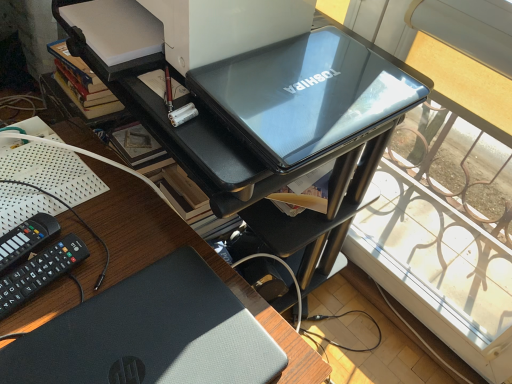
What do you see at coordinates (150, 334) in the screenshot? I see `slate gray matte laptop at lower left` at bounding box center [150, 334].

Locate an element on the screen. glossy white printer at upper center is located at coordinates (186, 27).

You are a GUI agent. You are given a task and a screenshot of the screen. Output one action in this format:
    pyautogui.click(x=<x>, y=<y>)
    Task: Click on the black plastic remote control at lower left, placed as the 1th equipment when sorted from left to right
    This screenshot has height=384, width=512.
    Given the screenshot: What is the action you would take?
    pyautogui.click(x=26, y=239)

What is the approximate height of black plastic remote control at lower left, placed as the 1th equipment when sorted from left to right?

The height of black plastic remote control at lower left, placed as the 1th equipment when sorted from left to right, is 1.17 inches.

The width and height of the screenshot is (512, 384). What are the coordinates of `slate gray matte laptop at lower left` in the screenshot? It's located at (150, 334).

Considering the positions of point (320, 83) and point (18, 355), is point (320, 83) closer or farther from the camera than point (18, 355)?

Point (320, 83) is positioned farther from the camera compared to point (18, 355).

Can slate gray matte laptop at lower left be found inside glossy black laptop at upper center?

Actually, slate gray matte laptop at lower left is outside glossy black laptop at upper center.

From the image's perspective, is glossy black laptop at upper center under slate gray matte laptop at lower left?

Actually, glossy black laptop at upper center appears above slate gray matte laptop at lower left in the image.

Is slate gray matte laptop at lower left placed right next to glossy white printer at upper center?

No.

Which point is more forward, (x=198, y=341) or (x=160, y=7)?

Positioned in front is point (x=198, y=341).

Looking at this image, choose the correct answer: Is slate gray matte laptop at lower left inside glossy white printer at upper center or outside it?

slate gray matte laptop at lower left lies outside glossy white printer at upper center.

From the picture: From the image's perspective, is slate gray matte laptop at lower left under glossy white printer at upper center?

Yes.

Does point (38, 256) come in front of point (187, 342)?

No, it is behind (187, 342).

Who is bigger, black plastic remote control at lower left, which ranks as the second equipment in left-to-right order, or slate gray matte laptop at lower left?

Bigger between the two is slate gray matte laptop at lower left.

Considering the relative sizes of black plastic remote control at lower left, which ranks as the second equipment in left-to-right order, and slate gray matte laptop at lower left in the image provided, is black plastic remote control at lower left, which ranks as the second equipment in left-to-right order, shorter than slate gray matte laptop at lower left?

Incorrect, the height of black plastic remote control at lower left, which ranks as the second equipment in left-to-right order, does not fall short of that of slate gray matte laptop at lower left.

How far apart are black plastic remote control at lower left, which ranks as the first equipment in right-to-left order, and slate gray matte laptop at lower left?

The distance of black plastic remote control at lower left, which ranks as the first equipment in right-to-left order, from slate gray matte laptop at lower left is 16.54 centimeters.

Which is more to the left, glossy black laptop at upper center or glossy white printer at upper center?

From the viewer's perspective, glossy white printer at upper center appears more on the left side.

Between glossy black laptop at upper center and glossy white printer at upper center, which one has less height?

Standing shorter between the two is glossy black laptop at upper center.

Which point is more forward, (229, 102) or (215, 11)?

Positioned in front is point (229, 102).

Can you see glossy black laptop at upper center touching glossy white printer at upper center?

No, glossy black laptop at upper center is not next to glossy white printer at upper center.

From a real-world perspective, who is located lower, glossy white printer at upper center or black plastic remote control at lower left, the second equipment positioned from the right?

From a 3D spatial view, black plastic remote control at lower left, the second equipment positioned from the right, is below.

From the image's perspective, does glossy white printer at upper center appear higher than black plastic remote control at lower left, the second equipment positioned from the right?

Indeed, from the image's perspective, glossy white printer at upper center is shown above black plastic remote control at lower left, the second equipment positioned from the right.

Looking at this image, measure the distance between glossy white printer at upper center and black plastic remote control at lower left, placed as the 1th equipment when sorted from left to right.

glossy white printer at upper center and black plastic remote control at lower left, placed as the 1th equipment when sorted from left to right, are 16.28 inches apart from each other.

Would you say glossy black laptop at upper center is part of black plastic remote control at lower left, which ranks as the second equipment in left-to-right order,'s contents?

Actually, glossy black laptop at upper center is outside black plastic remote control at lower left, which ranks as the second equipment in left-to-right order.

Does black plastic remote control at lower left, which ranks as the second equipment in left-to-right order, have a larger size compared to glossy black laptop at upper center?

Incorrect, black plastic remote control at lower left, which ranks as the second equipment in left-to-right order, is not larger than glossy black laptop at upper center.

Between point (0, 295) and point (324, 107), which one is positioned behind?

The point (324, 107) is more distant.

Is black plastic remote control at lower left, which ranks as the second equipment in left-to-right order, wider or thinner than glossy black laptop at upper center?

In the image, black plastic remote control at lower left, which ranks as the second equipment in left-to-right order, appears to be more narrow than glossy black laptop at upper center.

Is glossy white printer at upper center not close to black plastic remote control at lower left, which ranks as the first equipment in right-to-left order?

glossy white printer at upper center is near black plastic remote control at lower left, which ranks as the first equipment in right-to-left order, not far away.

From their relative heights in the image, would you say glossy white printer at upper center is taller or shorter than black plastic remote control at lower left, which ranks as the first equipment in right-to-left order?

In the image, glossy white printer at upper center appears to be taller than black plastic remote control at lower left, which ranks as the first equipment in right-to-left order.

From the image's perspective, is glossy white printer at upper center on black plastic remote control at lower left, which ranks as the first equipment in right-to-left order?

Yes, from the image's perspective, glossy white printer at upper center is over black plastic remote control at lower left, which ranks as the first equipment in right-to-left order.

Is black plastic remote control at lower left, which ranks as the first equipment in right-to-left order, surrounded by glossy white printer at upper center?

No, black plastic remote control at lower left, which ranks as the first equipment in right-to-left order, is not inside glossy white printer at upper center.

In order to click on computer above the slate gray matte laptop at lower left (from the image's perspective) in this screenshot , I will do point(305,95).

The height and width of the screenshot is (384, 512). Identify the location of printer lying on the right of slate gray matte laptop at lower left. (186, 27).

Which object lies further to the anchor point black plastic remote control at lower left, which ranks as the second equipment in left-to-right order, glossy black laptop at upper center or black plastic remote control at lower left, the second equipment positioned from the right?

glossy black laptop at upper center is positioned further to the anchor black plastic remote control at lower left, which ranks as the second equipment in left-to-right order.

Looking at the image, which one is located closer to black plastic remote control at lower left, which ranks as the second equipment in left-to-right order, slate gray matte laptop at lower left or glossy black laptop at upper center?

Based on the image, slate gray matte laptop at lower left appears to be nearer to black plastic remote control at lower left, which ranks as the second equipment in left-to-right order.

Looking at the image, which one is located further to glossy black laptop at upper center, slate gray matte laptop at lower left or black plastic remote control at lower left, which ranks as the first equipment in right-to-left order?

Based on the image, black plastic remote control at lower left, which ranks as the first equipment in right-to-left order, appears to be further to glossy black laptop at upper center.

Based on their spatial positions, is black plastic remote control at lower left, placed as the 1th equipment when sorted from left to right, or glossy white printer at upper center further from glossy black laptop at upper center?

black plastic remote control at lower left, placed as the 1th equipment when sorted from left to right, is further to glossy black laptop at upper center.

Looking at this image, estimate the real-world distances between objects in this image. Which object is further from glossy black laptop at upper center, black plastic remote control at lower left, which ranks as the first equipment in right-to-left order, or slate gray matte laptop at lower left?

black plastic remote control at lower left, which ranks as the first equipment in right-to-left order, is positioned further to the anchor glossy black laptop at upper center.

In the scene shown: Looking at the image, which one is located closer to black plastic remote control at lower left, which ranks as the first equipment in right-to-left order, black plastic remote control at lower left, the second equipment positioned from the right, or slate gray matte laptop at lower left?

The object closer to black plastic remote control at lower left, which ranks as the first equipment in right-to-left order, is black plastic remote control at lower left, the second equipment positioned from the right.

Looking at this image, looking at the image, which one is located closer to slate gray matte laptop at lower left, glossy black laptop at upper center or black plastic remote control at lower left, the second equipment positioned from the right?

The object closer to slate gray matte laptop at lower left is black plastic remote control at lower left, the second equipment positioned from the right.

Based on their spatial positions, is glossy black laptop at upper center or slate gray matte laptop at lower left further from black plastic remote control at lower left, placed as the 1th equipment when sorted from left to right?

Among the two, glossy black laptop at upper center is located further to black plastic remote control at lower left, placed as the 1th equipment when sorted from left to right.

Identify the location of computer between glossy white printer at upper center and black plastic remote control at lower left, which ranks as the second equipment in left-to-right order, from top to bottom. 305,95.

Where is `equipment between black plastic remote control at lower left, placed as the 1th equipment when sorted from left to right, and glossy black laptop at upper center`? The height and width of the screenshot is (384, 512). equipment between black plastic remote control at lower left, placed as the 1th equipment when sorted from left to right, and glossy black laptop at upper center is located at coordinates (40, 273).

Find the location of `equipment between black plastic remote control at lower left, placed as the 1th equipment when sorted from left to right, and slate gray matte laptop at lower left from left to right`. equipment between black plastic remote control at lower left, placed as the 1th equipment when sorted from left to right, and slate gray matte laptop at lower left from left to right is located at coordinates (40, 273).

The height and width of the screenshot is (384, 512). Identify the location of computer between glossy white printer at upper center and slate gray matte laptop at lower left vertically. (305, 95).